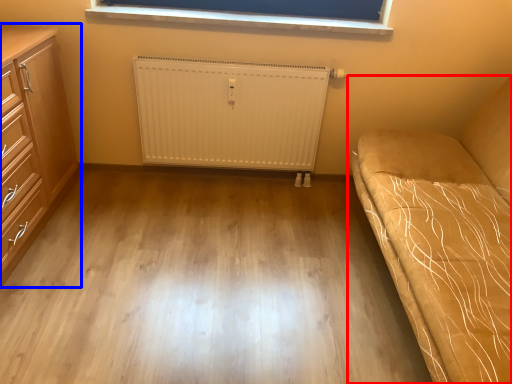
Question: Which object is further to the camera taking this photo, studio couch (highlighted by a red box) or chest of drawers (highlighted by a blue box)?

Choices:
 (A) studio couch
 (B) chest of drawers

Answer: (B)